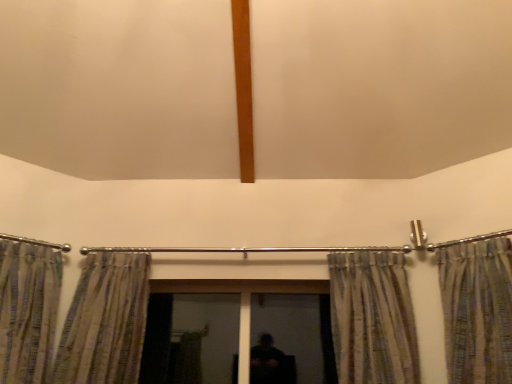
Question: From a real-world perspective, is striped fabric curtain at left, the 1th curtain from the left, physically located above or below striped fabric curtain at left, arranged as the third curtain when viewed from the right?

Choices:
 (A) above
 (B) below

Answer: (A)

Question: From the image's perspective, is striped fabric curtain at left, acting as the 4th curtain starting from the right, above or below striped fabric curtain at left, arranged as the third curtain when viewed from the right?

Choices:
 (A) below
 (B) above

Answer: (B)

Question: Which object is the closest to the metallic striped curtain at right, the fourth curtain viewed from the left?

Choices:
 (A) black matte screen door at center, placed as the 1th screen door when sorted from right to left
 (B) transparent glass screen door at center, marked as the first screen door in a left-to-right arrangement
 (C) striped fabric curtain at right, marked as the third curtain in a left-to-right arrangement
 (D) striped fabric curtain at left, the second curtain from the left
 (E) striped fabric curtain at left, the 1th curtain from the left

Answer: (C)

Question: Estimate the real-world distances between objects in this image. Which object is closer to the striped fabric curtain at left, the 1th curtain from the left?

Choices:
 (A) striped fabric curtain at right, acting as the 2th curtain starting from the right
 (B) black matte screen door at center, placed as the 1th screen door when sorted from right to left
 (C) metallic striped curtain at right, which is counted as the first curtain, starting from the right
 (D) striped fabric curtain at left, arranged as the third curtain when viewed from the right
 (E) transparent glass screen door at center, the second screen door in the right-to-left sequence

Answer: (D)